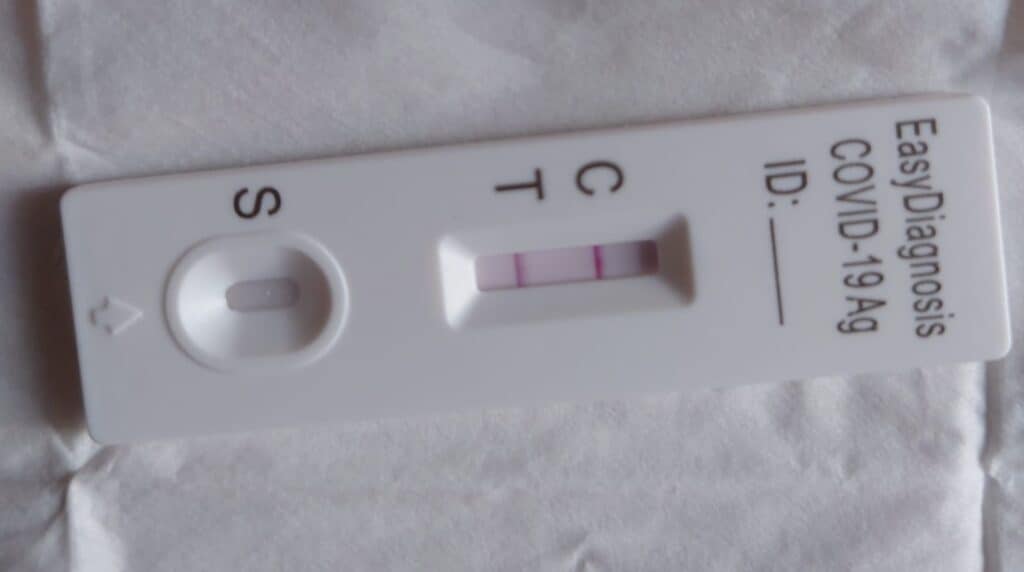
At what (x,y) coordinates should I click in order to perform the action: click on white surface. Please return your answer as a coordinate pair (x, y). This screenshot has width=1024, height=572. Looking at the image, I should click on (464, 502), (390, 89).